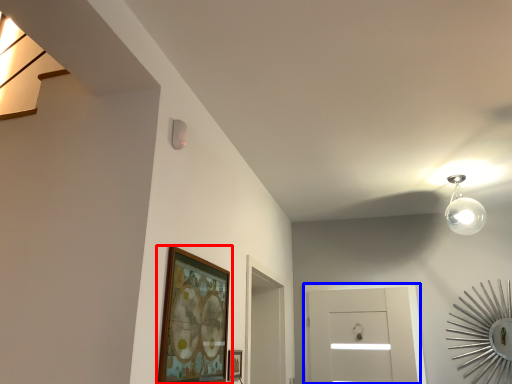
Question: Which object appears farthest to the camera in this image, picture frame (highlighted by a red box) or glass door (highlighted by a blue box)?

Choices:
 (A) picture frame
 (B) glass door

Answer: (B)